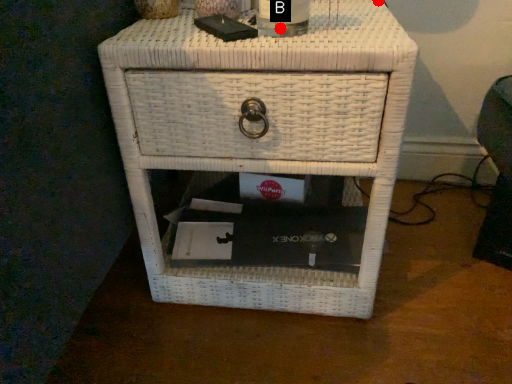
Question: Two points are circled on the image, labeled by A and B beside each circle. Which point appears farthest from the camera in this image?

Choices:
 (A) A is further
 (B) B is further

Answer: (A)